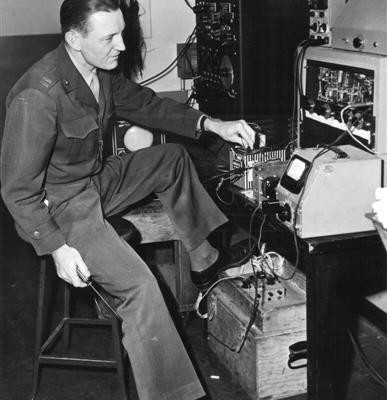
Image resolution: width=387 pixels, height=400 pixels. I want to click on wooden box, so click(260, 357).